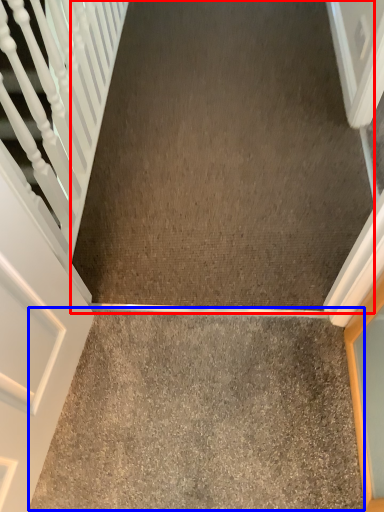
Question: Which of the following is the closest to the observer, concrete (highlighted by a red box) or concrete (highlighted by a blue box)?

Choices:
 (A) concrete
 (B) concrete

Answer: (B)